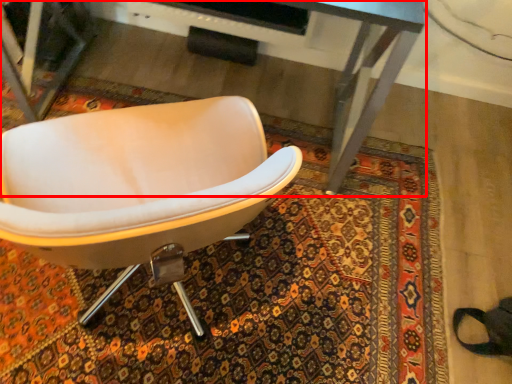
Question: From the image, what is the correct spatial relationship of desk (annotated by the red box) in relation to chair?

Choices:
 (A) left
 (B) right

Answer: (B)